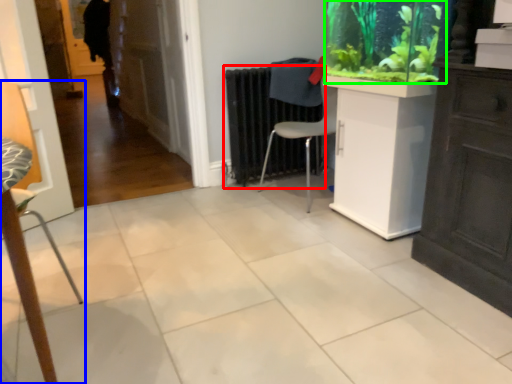
Question: Which object is the closest to the radiator (highlighted by a red box)? Choose among these: chair (highlighted by a blue box) or plant (highlighted by a green box).

Choices:
 (A) chair
 (B) plant

Answer: (B)